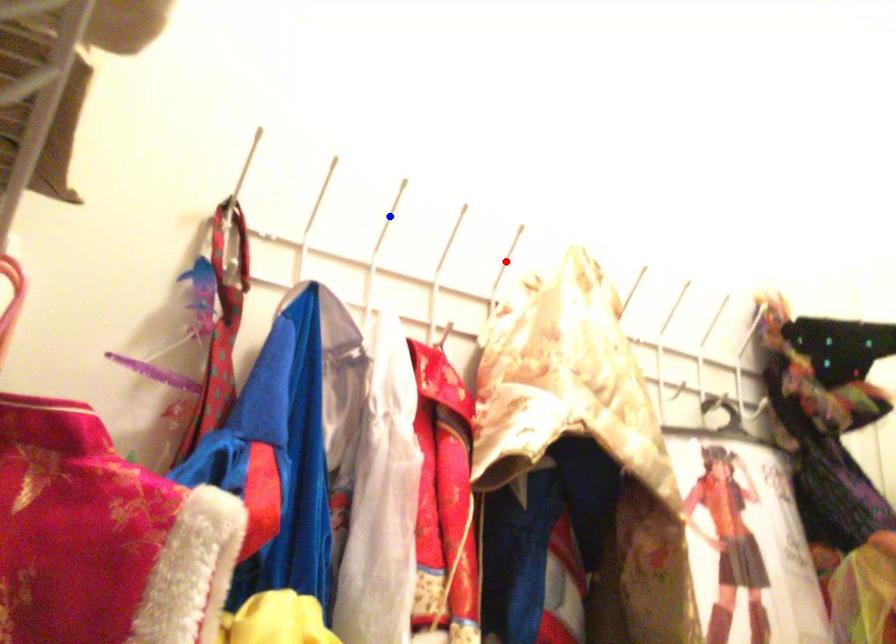
Question: In the image, two points are highlighted. Which point is nearer to the camera? Reply with the corresponding letter.

Choices:
 (A) blue point
 (B) red point

Answer: (A)